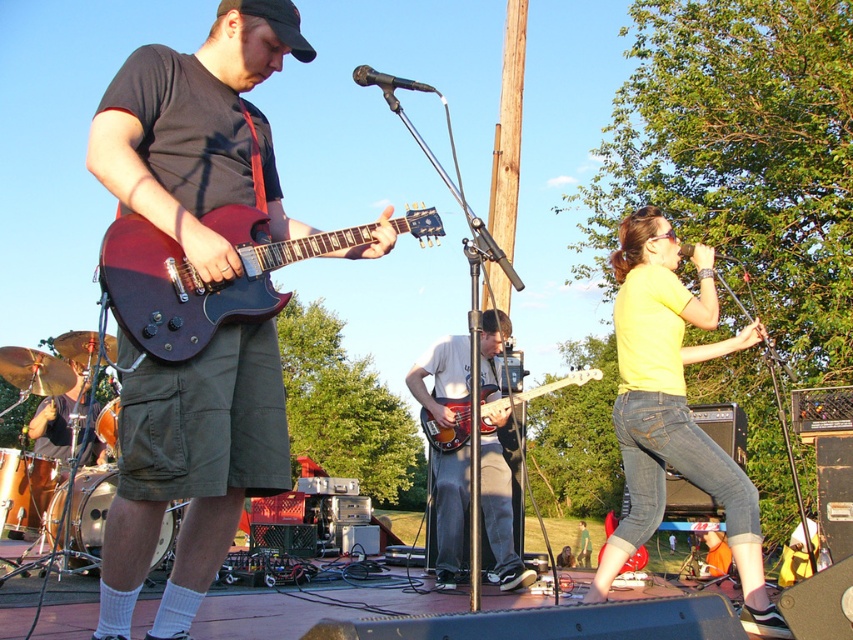
You are a stagehand setting up a storage rack for musical instruments. The rack has two slots side by side. The left slot is 30 cm wide, and the right slot is 40 cm wide. You need to place the matte black guitar at center and the glossy wood bass at center into these slots. Which instrument should go into which slot to ensure they both fit properly?

The matte black guitar at center has a smaller width than the glossy wood bass at center. Since the left slot is 30 cm and the right slot is 40 cm, the matte black guitar at center should go into the left slot and the glossy wood bass at center into the right slot to fit properly.

You are an event photographer at the live music performance. You need to capture a closeup shot of the yellow matte shirt at center and the glossy wood bass at center. Since the camera can only focus on one subject at a time, which object should you focus on first if you want to ensure the wider object is in focus first?

The glossy wood bass at center is wider than the yellow matte shirt at center, so you should focus on the glossy wood bass at center first to ensure the wider object is in focus first.

You are a stagehand setting up a music performance. You need to place a large amplifier behind the two instruments at center. Which instrument should the amplifier be placed behind, the matte black guitar at center or the glossy wood bass at center?

The amplifier should be placed behind the matte black guitar at center because it is bigger than the glossy wood bass at center, so it likely requires more space.